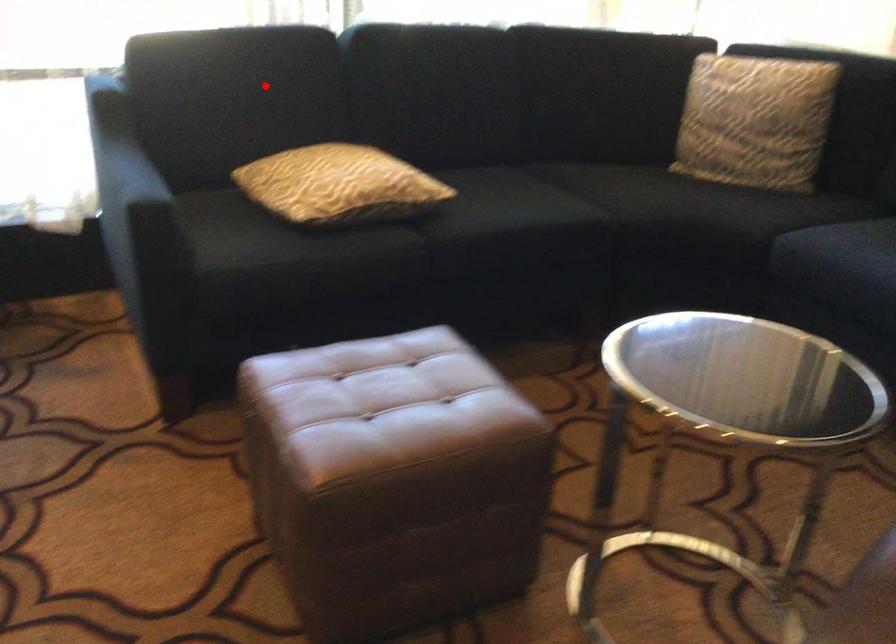
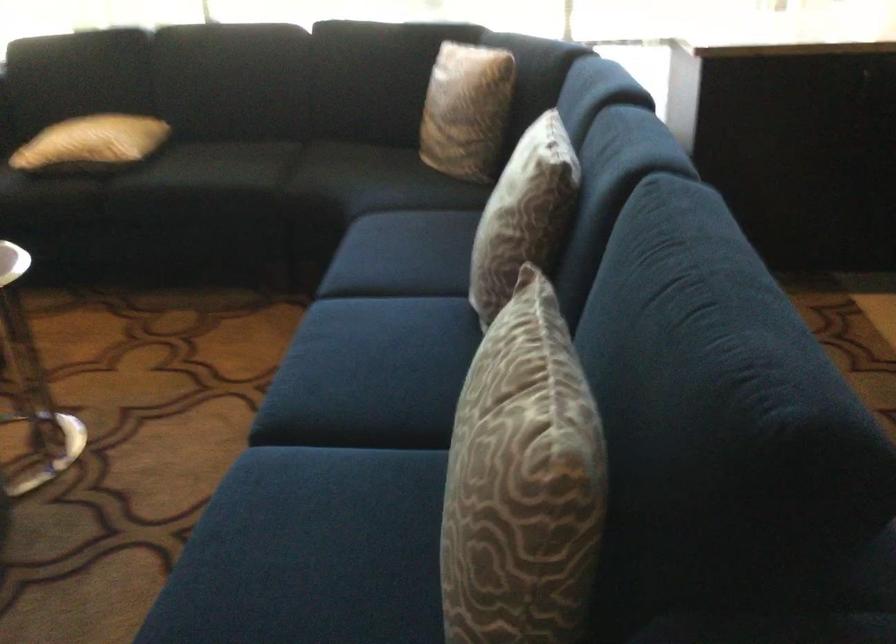
Where in the second image is the point corresponding to the highlighted location from the first image?

(82, 64)